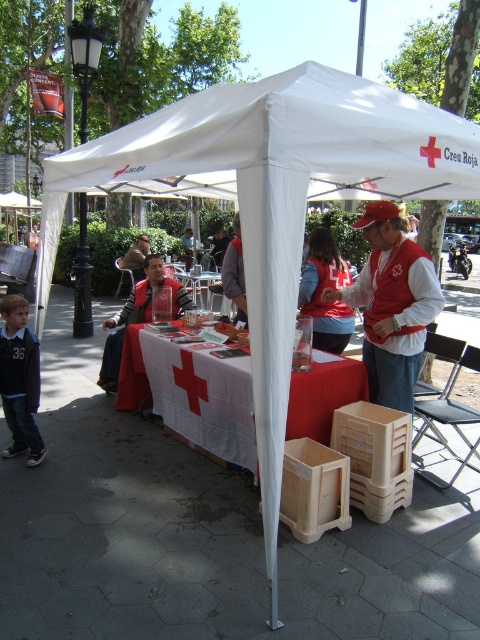
Based on the photo, you are a volunteer at the Red Cross event and need to place a 5.5 feet long banner between the red matte vest at center and the red fabric jacket at center. Can the banner fit between them without overlapping either item?

The distance between the red matte vest at center and the red fabric jacket at center is 6.07 feet. Since the banner is 5.5 feet long, it can fit between them without overlapping either item as there is enough space.